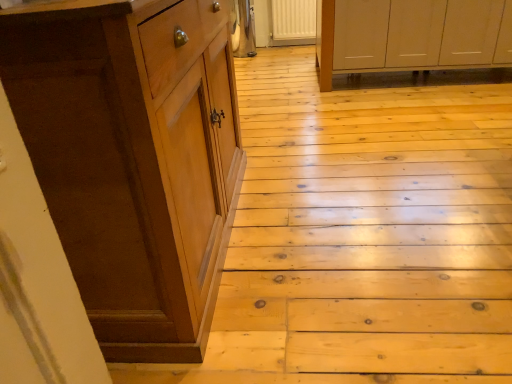
Question: In terms of size, does brown wood cabinet at left, which is the 2th cabinetry in top-to-bottom order, appear bigger or smaller than white matte cabinet at upper right, arranged as the 1th cabinetry when viewed from the top?

Choices:
 (A) big
 (B) small

Answer: (B)

Question: Do you think brown wood cabinet at left, which is the 2th cabinetry in top-to-bottom order, is within white matte cabinet at upper right, positioned as the 2th cabinetry in left-to-right order, or outside of it?

Choices:
 (A) inside
 (B) outside

Answer: (B)

Question: Estimate the real-world distances between objects in this image. Which object is closer to the white matte cabinet at upper right, the 1th cabinetry in the back-to-front sequence?

Choices:
 (A) wooden at left
 (B) brown wood cabinet at left, the first cabinetry viewed from the left

Answer: (A)

Question: Based on their relative distances, which object is nearer to the white matte cabinet at upper right, positioned as the 2th cabinetry in left-to-right order?

Choices:
 (A) wooden at left
 (B) brown wood cabinet at left, which is the first cabinetry from front to back

Answer: (A)